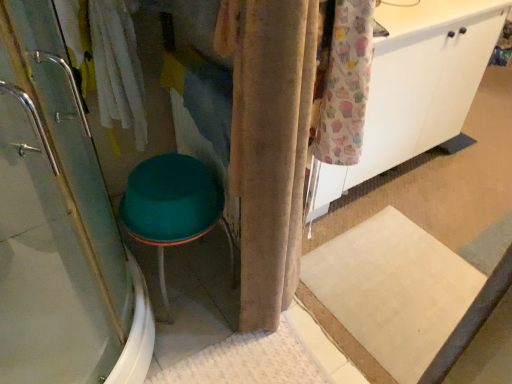
The height and width of the screenshot is (384, 512). I want to click on teal plastic stool at lower left, so click(x=172, y=207).

Find the location of a particular element. The height and width of the screenshot is (384, 512). clear glass shower door at left is located at coordinates (59, 225).

Find the location of a particular element. teal plastic stool at lower left is located at coordinates (172, 207).

Based on the photo, are white matte cabinet at upper right and teal plastic stool at lower left beside each other?

white matte cabinet at upper right and teal plastic stool at lower left are clearly separated.

Considering the sizes of objects white matte cabinet at upper right and teal plastic stool at lower left in the image provided, who is wider, white matte cabinet at upper right or teal plastic stool at lower left?

With larger width is teal plastic stool at lower left.

Is white matte cabinet at upper right in front of or behind teal plastic stool at lower left in the image?

Clearly, white matte cabinet at upper right is in front of teal plastic stool at lower left.

From the image's perspective, which is above, white matte cabinet at upper right or teal plastic stool at lower left?

white matte cabinet at upper right appears higher in the image.

Which is behind, point (148, 243) or point (53, 209)?

The point (53, 209) is farther from the camera.

Looking at their sizes, would you say teal plastic stool at lower left is wider or thinner than clear glass shower door at left?

teal plastic stool at lower left is thinner than clear glass shower door at left.

From the image's perspective, is teal plastic stool at lower left below clear glass shower door at left?

Yes.

Is teal plastic stool at lower left inside the boundaries of clear glass shower door at left, or outside?

teal plastic stool at lower left is located beyond the bounds of clear glass shower door at left.

What's the angular difference between teal plastic stool at lower left and velvet beige curtain at center's facing directions?

The angular difference between teal plastic stool at lower left and velvet beige curtain at center is 92.2 degrees.

Is teal plastic stool at lower left with velvet beige curtain at center?

teal plastic stool at lower left and velvet beige curtain at center are not in contact.

Is teal plastic stool at lower left looking in the opposite direction of velvet beige curtain at center?

That's not correct — teal plastic stool at lower left is not looking away from velvet beige curtain at center.

Where is `curtain located in front of the teal plastic stool at lower left`? curtain located in front of the teal plastic stool at lower left is located at coordinates (269, 143).

Would you say velvet beige curtain at center is a long distance from teal plastic stool at lower left?

velvet beige curtain at center is near teal plastic stool at lower left, not far away.

Do you think velvet beige curtain at center is within teal plastic stool at lower left, or outside of it?

velvet beige curtain at center is not inside teal plastic stool at lower left, it's outside.

Between point (269, 165) and point (133, 222), which one is positioned in front?

Positioned in front is point (269, 165).

Which is behind, point (45, 373) or point (297, 101)?

The point (45, 373) is farther.

This screenshot has height=384, width=512. What are the coordinates of `shower door in front of the velvet beige curtain at center` in the screenshot? It's located at (59, 225).

Is clear glass shower door at left taller than velvet beige curtain at center?

Correct, clear glass shower door at left is much taller as velvet beige curtain at center.

From a real-world perspective, is clear glass shower door at left located beneath white matte cabinet at upper right?

Yes.

In terms of size, does clear glass shower door at left appear bigger or smaller than white matte cabinet at upper right?

Considering their sizes, clear glass shower door at left takes up more space than white matte cabinet at upper right.

Is point (105, 336) closer to viewer compared to point (390, 80)?

Yes, point (105, 336) is in front of point (390, 80).

Can you confirm if clear glass shower door at left is positioned to the right of white matte cabinet at upper right?

No, clear glass shower door at left is not to the right of white matte cabinet at upper right.

Are clear glass shower door at left and teal plastic stool at lower left beside each other?

No, clear glass shower door at left is not beside teal plastic stool at lower left.

In the scene shown: Is clear glass shower door at left to the left of teal plastic stool at lower left from the viewer's perspective?

Yes.

Looking at their sizes, would you say clear glass shower door at left is wider or thinner than teal plastic stool at lower left?

clear glass shower door at left is wider than teal plastic stool at lower left.

Locate an element on the screen. This screenshot has width=512, height=384. cabinetry on the right of teal plastic stool at lower left is located at coordinates (418, 84).

This screenshot has width=512, height=384. I want to click on step stool directly beneath the clear glass shower door at left (from a real-world perspective), so click(172, 207).

Which object lies further to the anchor point clear glass shower door at left, white matte cabinet at upper right or teal plastic stool at lower left?

white matte cabinet at upper right.

From the image, which object appears to be nearer to teal plastic stool at lower left, clear glass shower door at left or white matte cabinet at upper right?

clear glass shower door at left.

Based on their spatial positions, is white matte cabinet at upper right or clear glass shower door at left closer to velvet beige curtain at center?

clear glass shower door at left is positioned closer to the anchor velvet beige curtain at center.

When comparing their distances from teal plastic stool at lower left, does clear glass shower door at left or velvet beige curtain at center seem closer?

Among the two, velvet beige curtain at center is located nearer to teal plastic stool at lower left.

Looking at the image, which one is located further to clear glass shower door at left, teal plastic stool at lower left or velvet beige curtain at center?

velvet beige curtain at center.

Based on their spatial positions, is velvet beige curtain at center or teal plastic stool at lower left closer to clear glass shower door at left?

teal plastic stool at lower left lies closer to clear glass shower door at left than the other object.

Looking at the image, which one is located closer to teal plastic stool at lower left, white matte cabinet at upper right or clear glass shower door at left?

clear glass shower door at left.

When comparing their distances from velvet beige curtain at center, does clear glass shower door at left or teal plastic stool at lower left seem closer?

teal plastic stool at lower left is closer to velvet beige curtain at center.

Identify the location of curtain located between clear glass shower door at left and white matte cabinet at upper right in the left-right direction. (269, 143).

In order to click on cabinetry between clear glass shower door at left and teal plastic stool at lower left along the z-axis in this screenshot , I will do `click(418, 84)`.

Locate an element on the screen. The height and width of the screenshot is (384, 512). curtain between clear glass shower door at left and teal plastic stool at lower left in the front-back direction is located at coordinates (269, 143).

Identify the location of curtain located between teal plastic stool at lower left and white matte cabinet at upper right in the left-right direction. This screenshot has height=384, width=512. (269, 143).